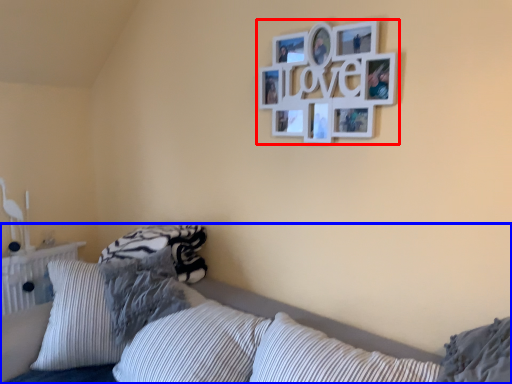
Question: Among these objects, which one is nearest to the camera, picture frame (highlighted by a red box) or bed (highlighted by a blue box)?

Choices:
 (A) picture frame
 (B) bed

Answer: (B)